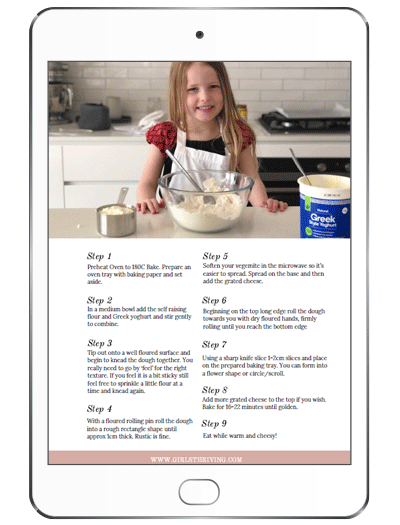
Where is `silver measuring cup`? The height and width of the screenshot is (525, 400). silver measuring cup is located at coordinates (115, 225).